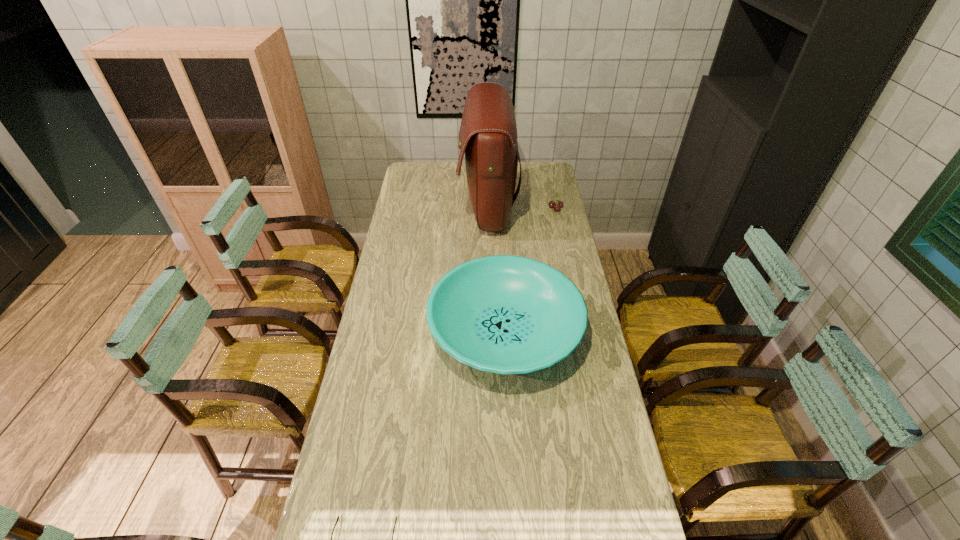
You are a GUI agent. You are given a task and a screenshot of the screen. Output one action in this format:
    pyautogui.click(x=<x>, y=<y>)
    Task: Click on the free space located on the leaves of the second shortest object
    
    Given the screenshot: What is the action you would take?
    pyautogui.click(x=503, y=208)

Locate an element on the screen. The width and height of the screenshot is (960, 540). object that is positioned at the far edge is located at coordinates (488, 135).

Locate an element on the screen. dish that is at the right edge is located at coordinates (504, 314).

The image size is (960, 540). I want to click on cherry that is at the right edge, so (557, 206).

Locate an element on the screen. The width and height of the screenshot is (960, 540). free space at the left edge is located at coordinates (372, 402).

Where is `free location at the right edge`? The image size is (960, 540). free location at the right edge is located at coordinates (598, 381).

In the image, there is a desktop. Identify the location of vacant space at the far right corner. (551, 164).

Locate which object ranks second in proximity to the shortest object. Please provide its 2D coordinates. Your answer should be formatted as a tuple, i.e. [(x, y)], where the tuple contains the x and y coordinates of a point satisfying the conditions above.

[(488, 135)]

Choose which object is the second nearest neighbor to the satchel. Please provide its 2D coordinates. Your answer should be formatted as a tuple, i.e. [(x, y)], where the tuple contains the x and y coordinates of a point satisfying the conditions above.

[(504, 314)]

Locate an element on the screen. The height and width of the screenshot is (540, 960). free space that satisfies the following two spatial constraints: 1. on the open flap of the second tallest object; 2. on the right side of the satchel is located at coordinates (491, 330).